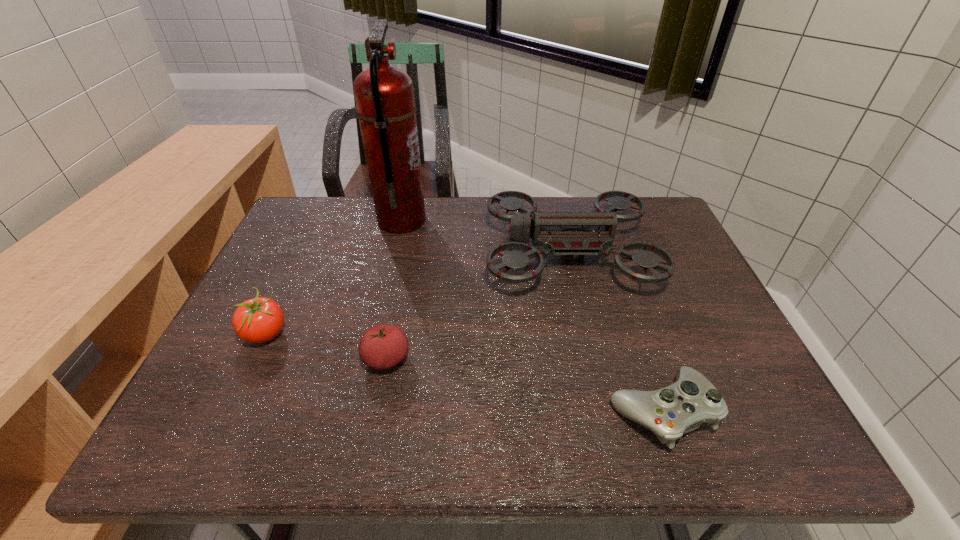
The width and height of the screenshot is (960, 540). I want to click on vacant space in between the right tomato and the leftmost object, so click(325, 347).

Find the location of `free spot between the right tomato and the tallest object`. free spot between the right tomato and the tallest object is located at coordinates (394, 290).

Locate an element on the screen. The width and height of the screenshot is (960, 540). vacant space that is in between the fire extinguisher and the shortest object is located at coordinates 532,316.

Where is `the closest object to the leftmost object`? This screenshot has width=960, height=540. the closest object to the leftmost object is located at coordinates (382, 347).

Where is `object that is the fourth nearest to the control`? The width and height of the screenshot is (960, 540). object that is the fourth nearest to the control is located at coordinates (258, 320).

Identify the location of vacant space that satisfies the following two spatial constraints: 1. on the side of the tallest object with the handle and hose; 2. on the right side of the right tomato. This screenshot has width=960, height=540. (370, 359).

Where is `free spot that satisfies the following two spatial constraints: 1. on the back side of the shortest object; 2. on the front-facing side of the second tallest object`? This screenshot has width=960, height=540. free spot that satisfies the following two spatial constraints: 1. on the back side of the shortest object; 2. on the front-facing side of the second tallest object is located at coordinates (608, 254).

This screenshot has height=540, width=960. I want to click on free spot that satisfies the following two spatial constraints: 1. on the side of the shortest object with the handle and hose; 2. on the left side of the fire extinguisher, so click(358, 411).

Identify the location of free space that satisfies the following two spatial constraints: 1. on the side of the tallest object with the handle and hose; 2. on the back side of the right tomato. Image resolution: width=960 pixels, height=540 pixels. (370, 359).

I want to click on vacant area in the image that satisfies the following two spatial constraints: 1. on the side of the right tomato with the handle and hose; 2. on the right side of the tallest object, so click(370, 359).